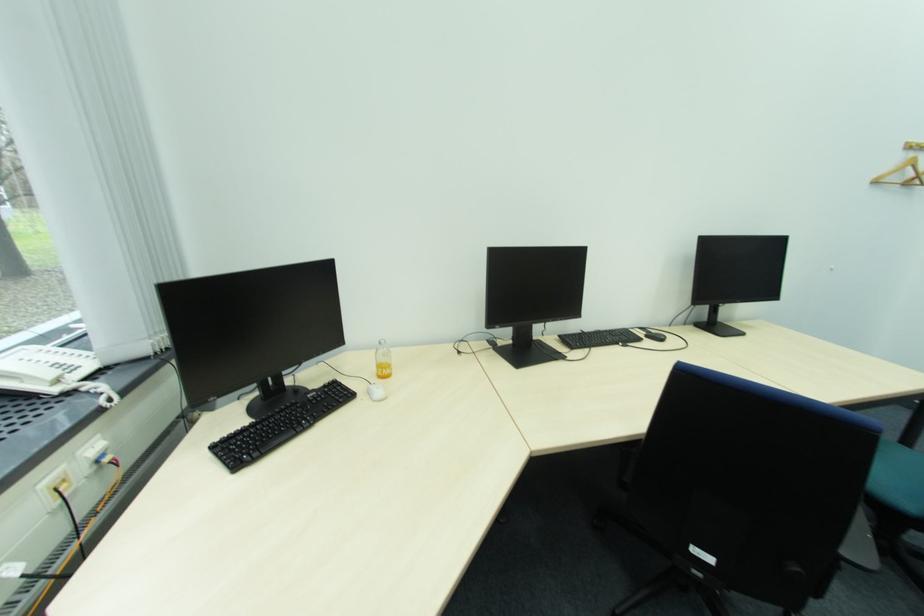
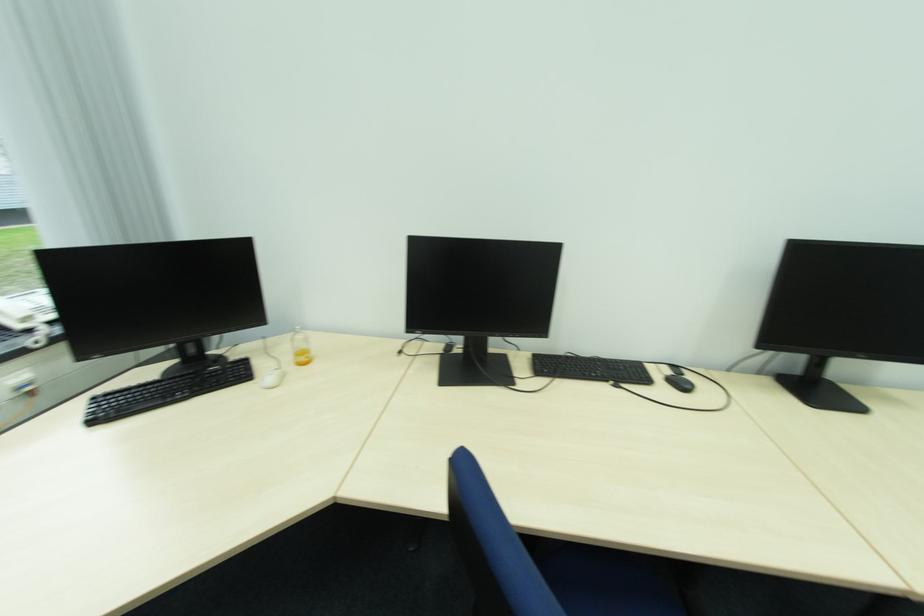
Find the pixel in the second image that matches point (391, 361) in the first image.

(310, 347)